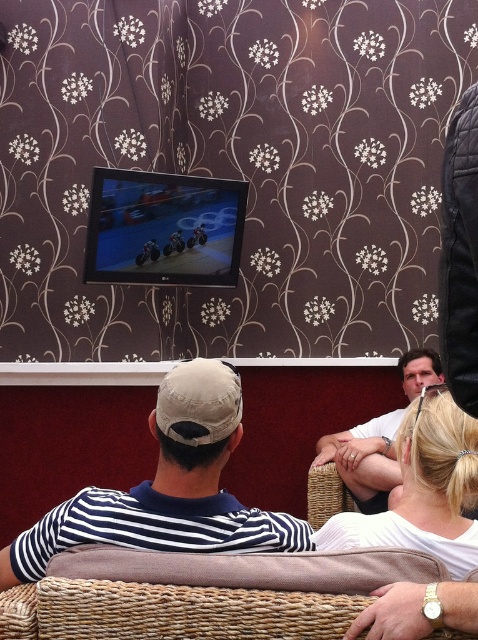
You are a tailor who needs to determine which shirt requires more fabric for alterations. Based on the scene, which shirt between the striped fabric shirt at center and the white matte shirt at lower right would need more fabric due to its size?

The striped fabric shirt at center requires more fabric for alterations because its width is larger than the white matte shirt at lower right.

You are trying to decide whether to place a new accessory on the striped fabric shirt at center or the white matte baseball cap at center. Based on their positions, which one is to the left?

The striped fabric shirt at center is positioned on the left side of the white matte baseball cap at center, so it is the leftmost item.

You are standing in the room and want to place a small plant between the two points, point [434,413] and point [176,387]. Which point should the plant be closer to so it is nearer to the viewer?

The plant should be placed closer to point [176,387] because it is closer to the viewer compared to point [434,413] which is further away.